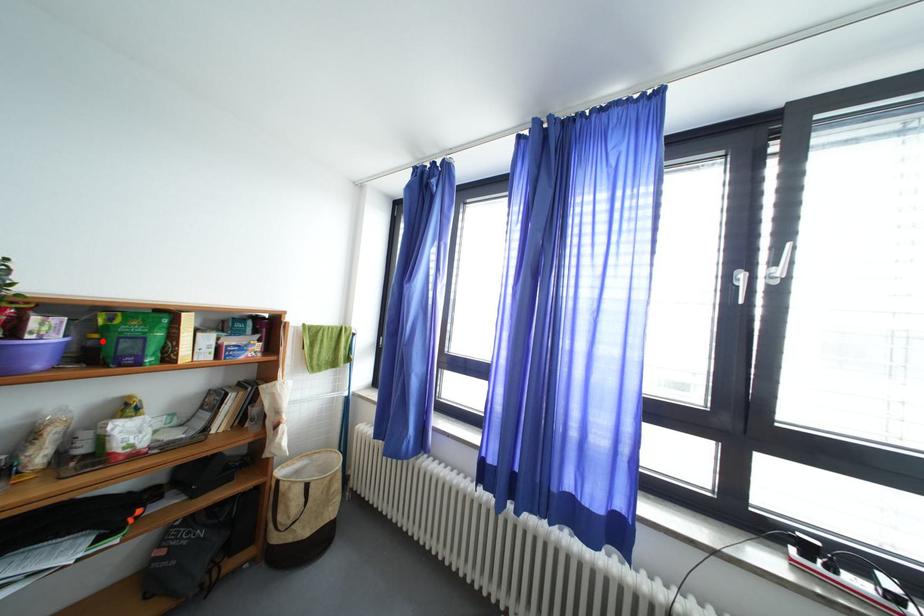
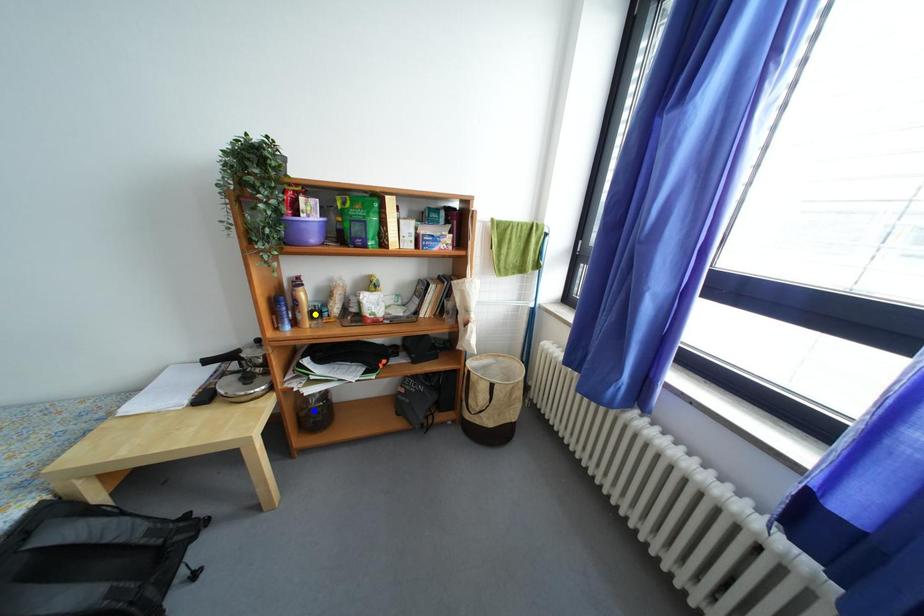
Question: I am providing you with two images of the same scene from different viewpoints. A red point is marked on the first image. You are given multiple points on the second image. Can you choose the point in image 2 that corresponds to the point in image 1?

Choices:
 (A) yellow point
 (B) blue point
 (C) green point

Answer: (C)